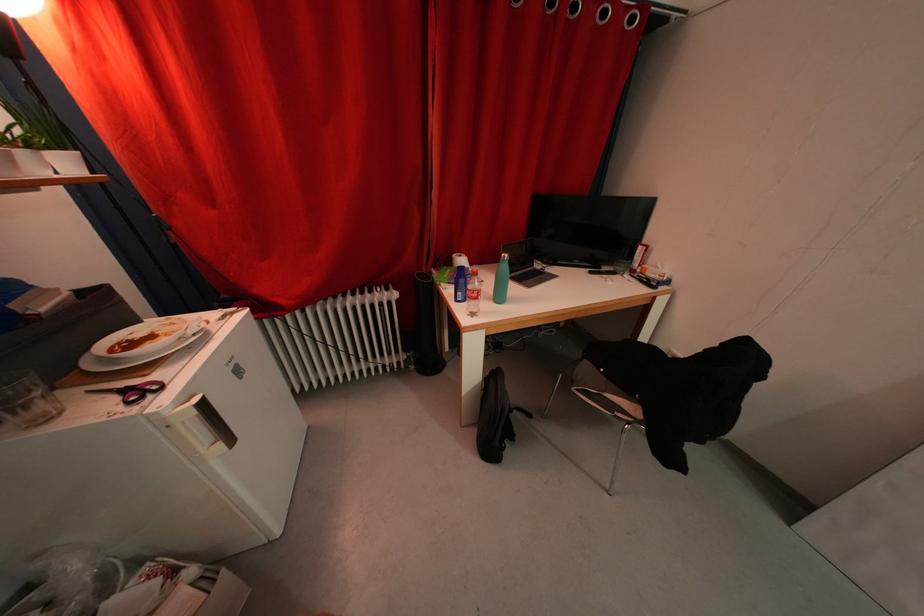
The location [131,391] corresponds to which object?

It corresponds to the pair of scissors in the image.